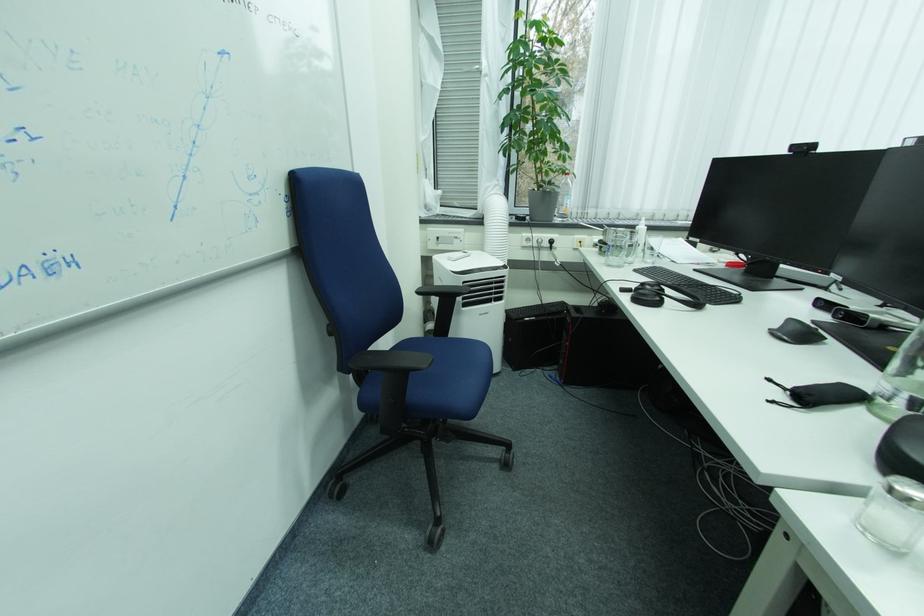
What do you see at coordinates (415, 360) in the screenshot? I see `a black chair armrest` at bounding box center [415, 360].